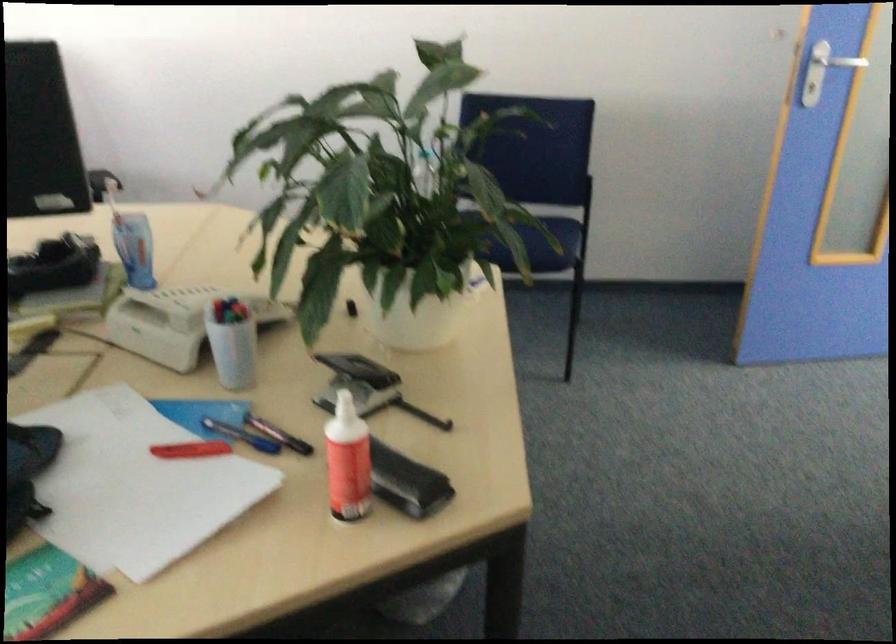
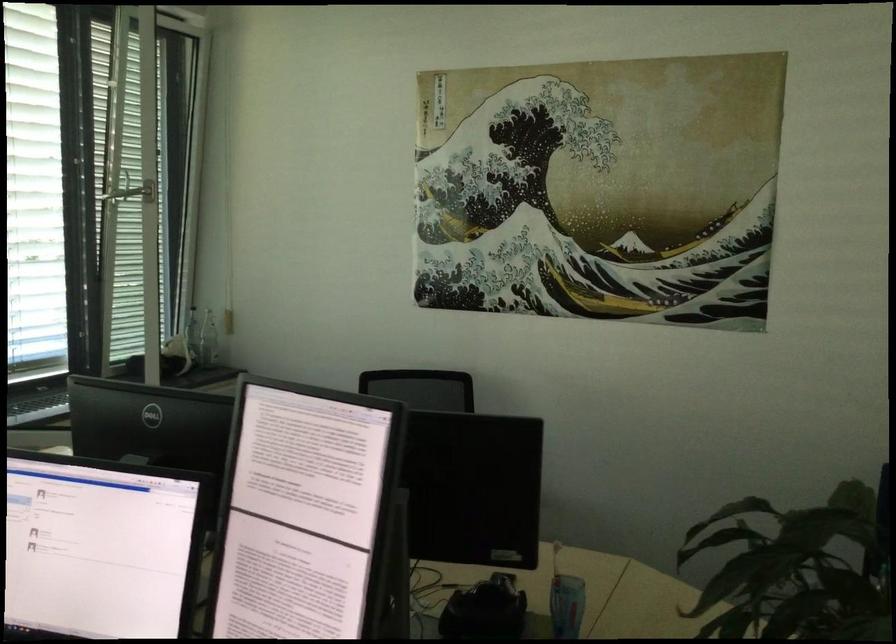
Locate, in the second image, the point that corresponds to point 141,243 in the first image.

(566, 605)